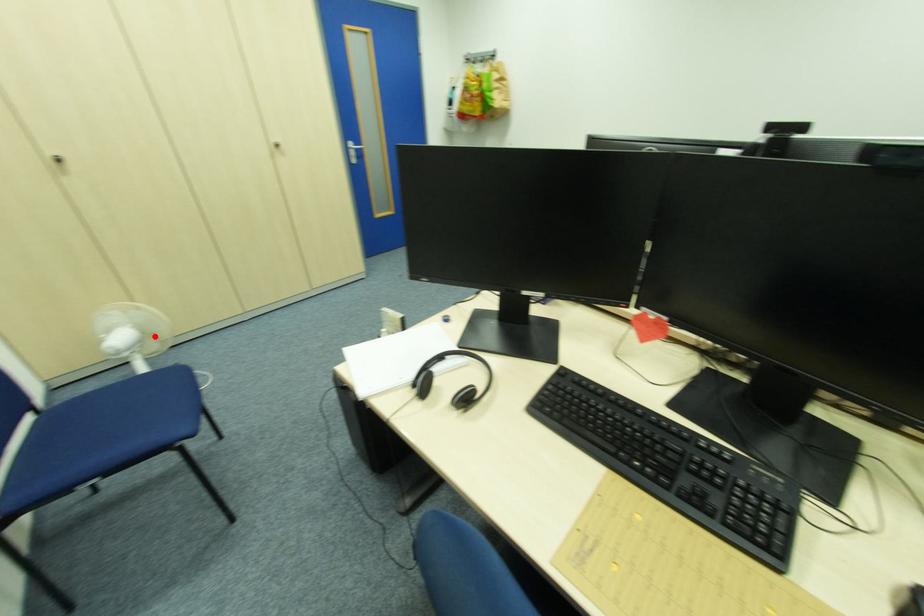
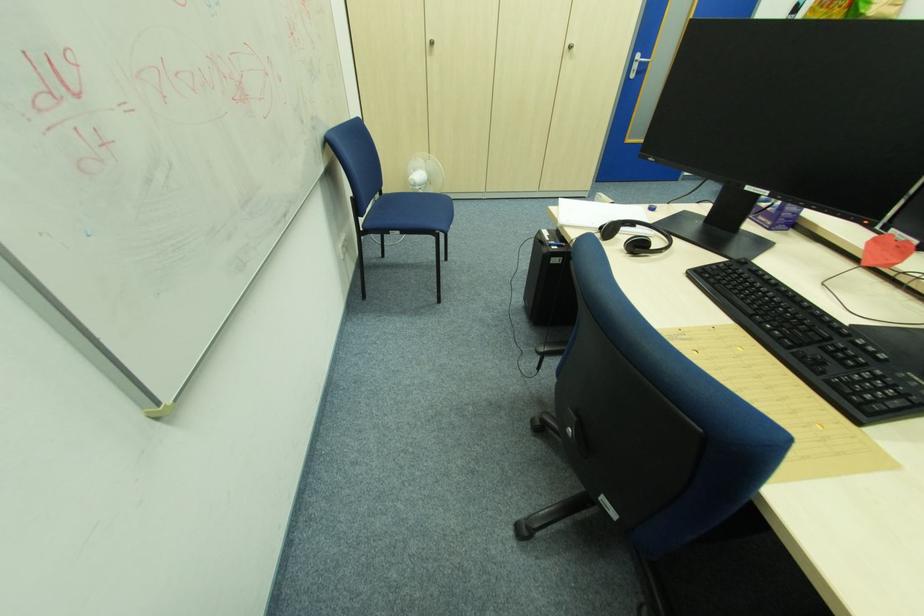
Question: I am providing you with two images of the same scene from different viewpoints. Given a red point in image1, look at the same physical point in image2. Is it:

Choices:
 (A) Closer to the viewpoint
 (B) Farther from the viewpoint

Answer: (B)